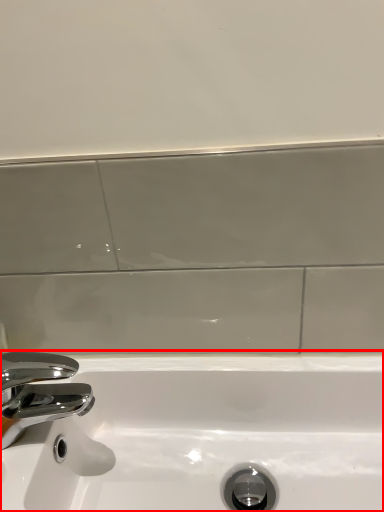
Question: From the image's perspective, where is sink (annotated by the red box) located in relation to tap in the image?

Choices:
 (A) above
 (B) below

Answer: (B)